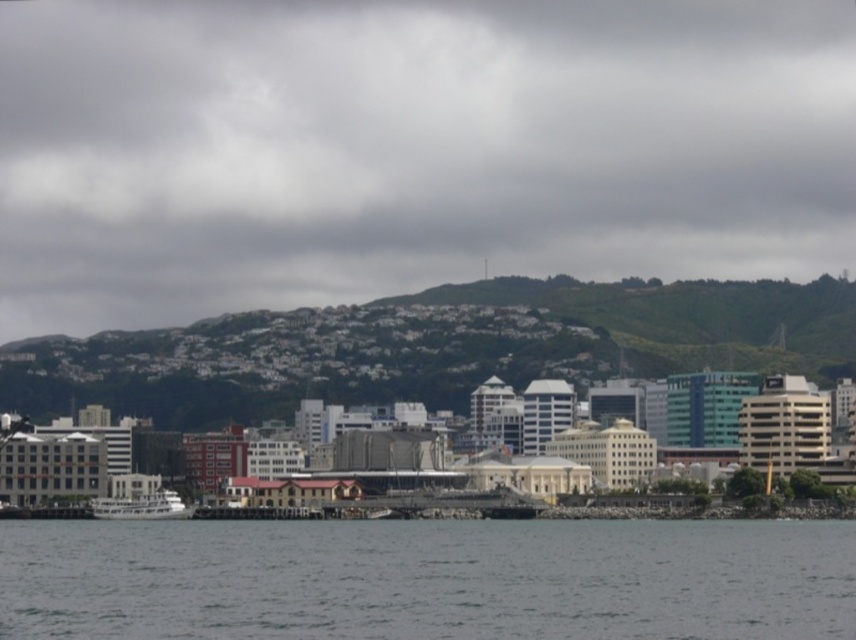
Between point (418, 536) and point (162, 508), which one is positioned behind?

Positioned behind is point (162, 508).

Is point (596, 532) positioned before point (158, 496)?

Yes.

The height and width of the screenshot is (640, 856). I want to click on gray water at lower center, so click(428, 579).

This screenshot has height=640, width=856. Describe the element at coordinates (409, 148) in the screenshot. I see `green grassy hill at upper center` at that location.

Can you confirm if green grassy hill at upper center is positioned below white matte boat at lower left?

No, green grassy hill at upper center is not below white matte boat at lower left.

Where is `green grassy hill at upper center`? The height and width of the screenshot is (640, 856). green grassy hill at upper center is located at coordinates (409, 148).

Which of these two, green grassy hill at upper center or gray water at lower center, stands taller?

With more height is green grassy hill at upper center.

Measure the distance from green grassy hill at upper center to gray water at lower center.

They are 144.55 meters apart.

Between point (666, 116) and point (421, 570), which one is positioned behind?

Point (666, 116)

Find the location of `green grassy hill at upper center`. green grassy hill at upper center is located at coordinates (409, 148).